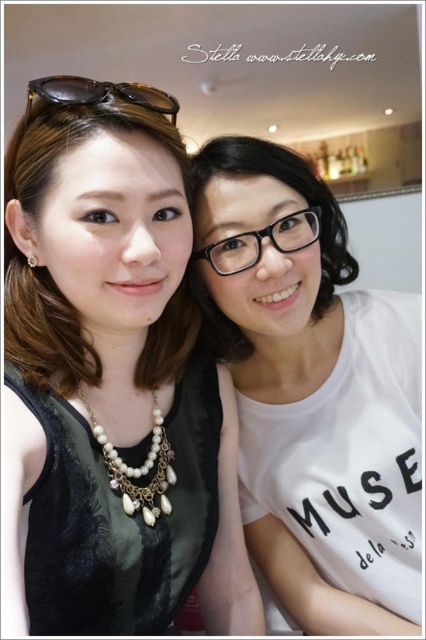
Is matte black dress at left bigger than pearl/golden chain necklace at center?

Indeed, matte black dress at left has a larger size compared to pearl/golden chain necklace at center.

In the scene shown: Which of these two, matte black dress at left or pearl/golden chain necklace at center, stands shorter?

With less height is pearl/golden chain necklace at center.

The image size is (426, 640). Describe the element at coordinates (111, 380) in the screenshot. I see `matte black dress at left` at that location.

Identify the location of matte black dress at left. (111, 380).

Which of these two, white matte t-shirt at center or pearl/golden chain necklace at center, stands taller?

With more height is white matte t-shirt at center.

Is white matte t-shirt at center further to the viewer compared to pearl/golden chain necklace at center?

Yes.

Is point (365, 380) positioned in front of point (123, 488)?

No.

Identify the location of white matte t-shirt at center. The image size is (426, 640). (313, 394).

Is point (216, 563) in front of point (382, 449)?

No, (216, 563) is behind (382, 449).

Does matte black dress at left have a lesser width compared to white matte t-shirt at center?

Incorrect, matte black dress at left's width is not less than white matte t-shirt at center's.

The height and width of the screenshot is (640, 426). Find the location of `matte black dress at left`. matte black dress at left is located at coordinates (111, 380).